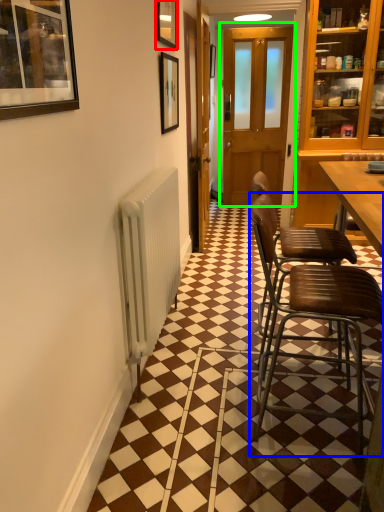
Question: Which object is positioned farthest from picture frame (highlighted by a red box)? Select from chair (highlighted by a blue box) and door (highlighted by a green box).

Choices:
 (A) chair
 (B) door

Answer: (B)